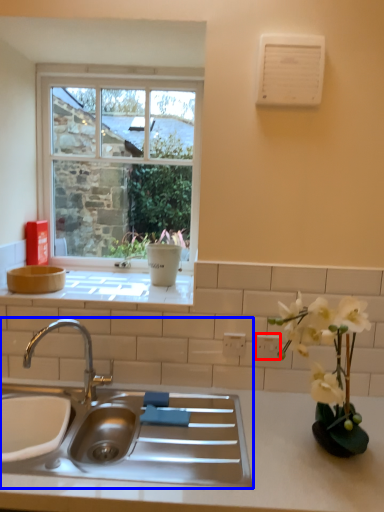
Question: Which object is further to the camera taking this photo, electric outlet (highlighted by a red box) or sink (highlighted by a blue box)?

Choices:
 (A) electric outlet
 (B) sink

Answer: (A)